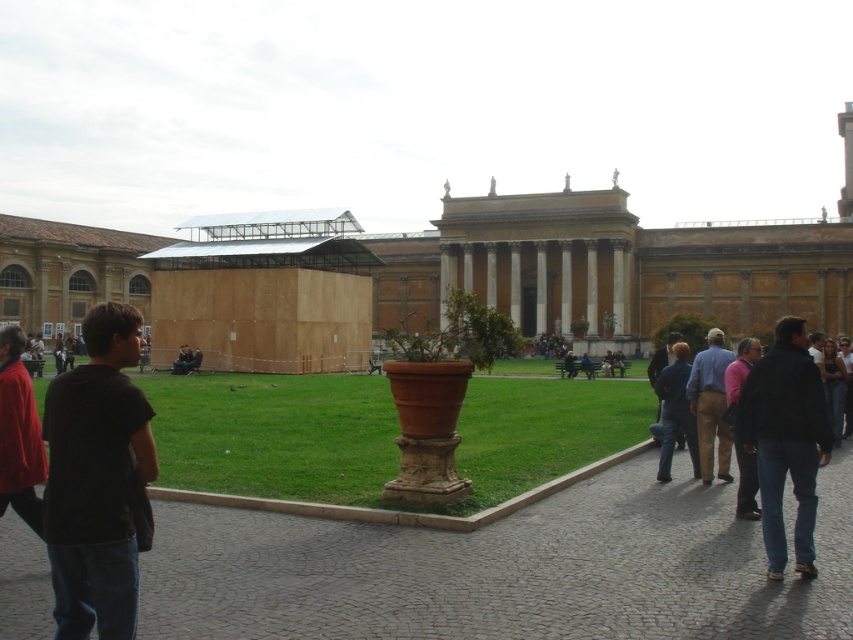
Is brown wooden structure at center taller than pink fabric at lower right?

→ Yes.

Who is more forward, (283, 291) or (730, 378)?

Positioned in front is point (730, 378).

The width and height of the screenshot is (853, 640). What are the coordinates of `brown wooden structure at center` in the screenshot? It's located at (463, 268).

Is cobblestone path at center bigger than pink fabric at lower right?

Yes.

Is cobblestone path at center below pink fabric at lower right?

Yes, cobblestone path at center is below pink fabric at lower right.

Image resolution: width=853 pixels, height=640 pixels. I want to click on cobblestone path at center, so click(x=505, y=568).

The width and height of the screenshot is (853, 640). What are the coordinates of `cobblestone path at center` in the screenshot? It's located at (505, 568).

Is point (238, 460) farther from viewer compared to point (672, 390)?

That is True.

Describe the element at coordinates (379, 433) in the screenshot. I see `green grass at center` at that location.

Who is more distant from viewer, (474,470) or (682,381)?

The point (682,381) is behind.

Locate an element on the screen. The image size is (853, 640). green grass at center is located at coordinates (379, 433).